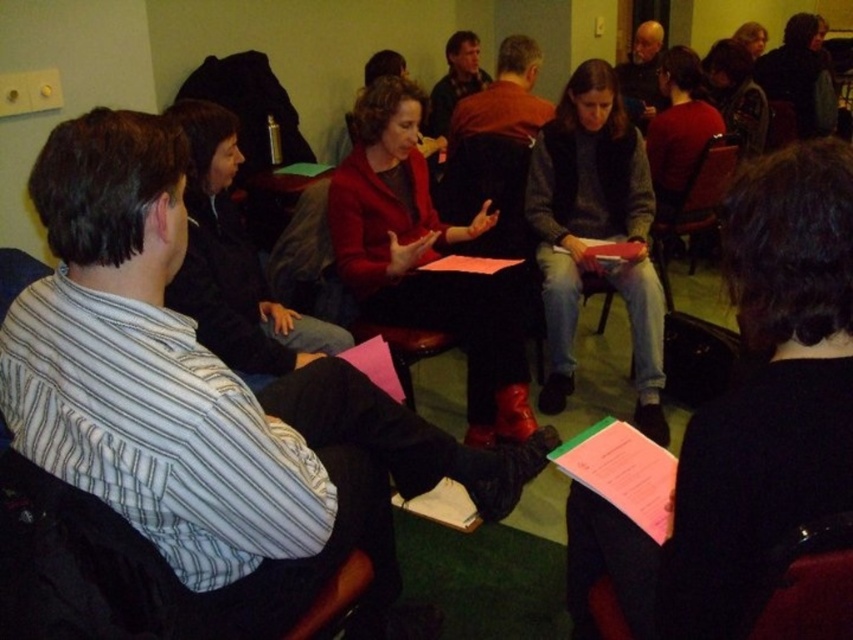
Which of these two, knit gray sweater at center or velvet-like dark red chair at lower right, stands taller?

knit gray sweater at center is taller.

Who is lower down, knit gray sweater at center or velvet-like dark red chair at lower right?

velvet-like dark red chair at lower right is lower down.

Who is more distant from viewer, (560, 392) or (809, 602)?

The point (560, 392) is behind.

I want to click on knit gray sweater at center, so click(595, 234).

Describe the element at coordinates (746, 416) in the screenshot. I see `matte black jacket at center` at that location.

Measure the distance between point (x=601, y=548) and camera.

Point (x=601, y=548) is 1.43 meters away from camera.

Where is `matte black jacket at center`? matte black jacket at center is located at coordinates (746, 416).

Measure the distance between point (351, 276) and camera.

Point (351, 276) is 8.63 feet away from camera.

Does matte red coat at center have a lesser width compared to knit gray sweater at center?

No.

Which is in front, point (480, 310) or point (662, 314)?

Point (480, 310) is more forward.

Locate an element on the screen. matte red coat at center is located at coordinates (424, 259).